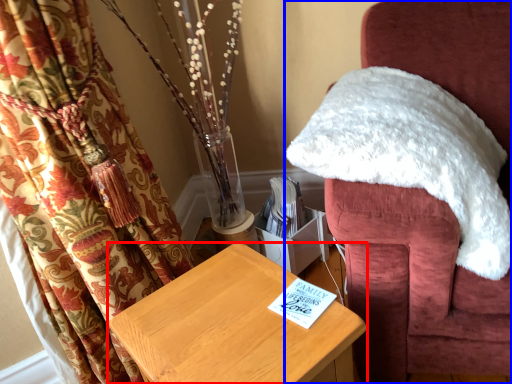
Question: Which object is closer to the camera taking this photo, furniture (highlighted by a red box) or chair (highlighted by a blue box)?

Choices:
 (A) furniture
 (B) chair

Answer: (A)